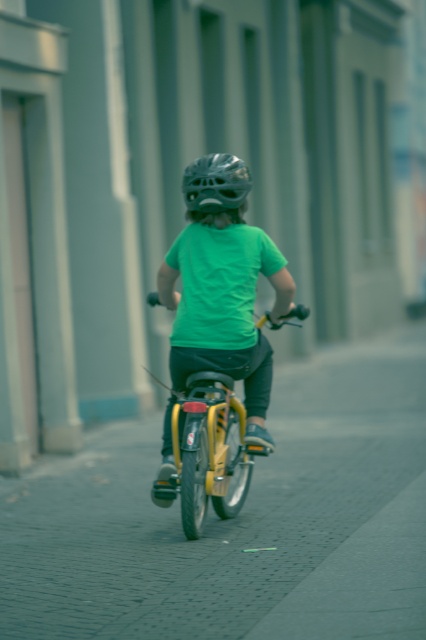
Question: Which object is farther from the camera taking this photo?

Choices:
 (A) shiny metallic helmet at center
 (B) cobblestone pavement at center
 (C) yellow matte bicycle at center

Answer: (A)

Question: Is cobblestone pavement at center smaller than shiny metallic helmet at center?

Choices:
 (A) no
 (B) yes

Answer: (A)

Question: Can you confirm if cobblestone pavement at center is thinner than yellow matte bicycle at center?

Choices:
 (A) no
 (B) yes

Answer: (A)

Question: Based on their relative distances, which object is nearer to the yellow matte bicycle at center?

Choices:
 (A) shiny metallic helmet at center
 (B) cobblestone pavement at center

Answer: (B)

Question: Based on their relative distances, which object is nearer to the cobblestone pavement at center?

Choices:
 (A) shiny metallic helmet at center
 (B) yellow matte bicycle at center

Answer: (B)

Question: Does yellow matte bicycle at center have a larger size compared to shiny metallic helmet at center?

Choices:
 (A) no
 (B) yes

Answer: (B)